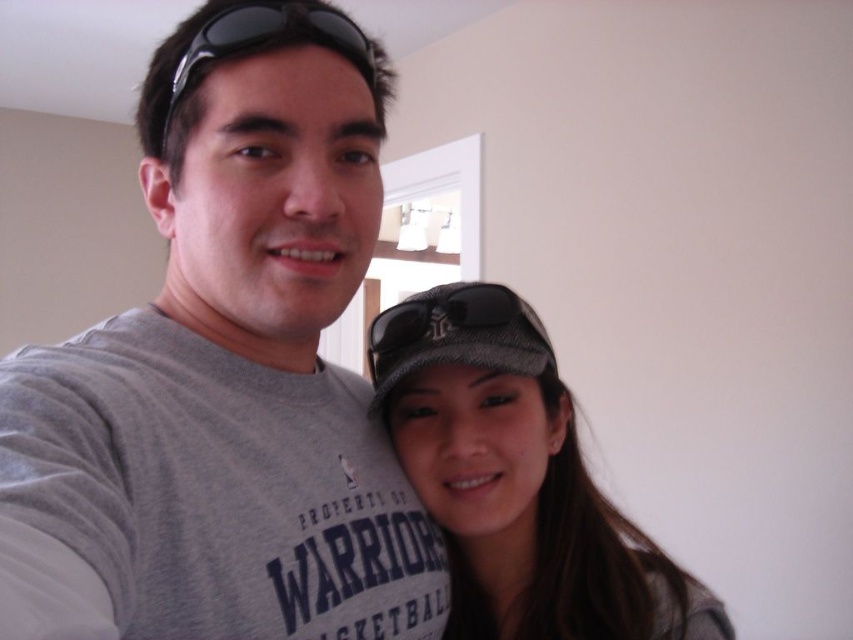
Question: Can you confirm if gray mesh baseball cap at lower right is positioned below black plastic sunglasses at upper center?

Choices:
 (A) yes
 (B) no

Answer: (A)

Question: From the image, what is the correct spatial relationship of textured gray cap at center in relation to black plastic sunglasses at upper center?

Choices:
 (A) below
 (B) above

Answer: (A)

Question: Which of the following is the closest to the observer?

Choices:
 (A) gray mesh baseball cap at lower right
 (B) black plastic sunglasses at upper center
 (C) gray matte t-shirt at center

Answer: (C)

Question: Is textured gray cap at center to the right of black plastic sunglasses at upper center from the viewer's perspective?

Choices:
 (A) no
 (B) yes

Answer: (B)

Question: Which of these objects is positioned closest to the gray matte t-shirt at center?

Choices:
 (A) textured gray cap at center
 (B) gray mesh baseball cap at lower right

Answer: (A)

Question: Estimate the real-world distances between objects in this image. Which object is farther from the textured gray cap at center?

Choices:
 (A) black plastic sunglasses at upper center
 (B) gray matte t-shirt at center

Answer: (A)